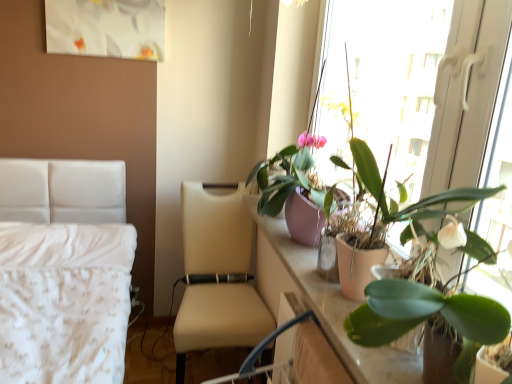
Question: Is the position of green matte plant at right, acting as the 3th houseplant starting from the bottom, less distant than that of green matte plant at upper right, placed as the first houseplant when sorted from bottom to top?

Choices:
 (A) yes
 (B) no

Answer: (A)

Question: Considering the relative positions of green matte plant at right, acting as the 3th houseplant starting from the bottom, and green matte plant at upper right, which is the third houseplant from top to bottom, in the image provided, is green matte plant at right, acting as the 3th houseplant starting from the bottom, to the left of green matte plant at upper right, which is the third houseplant from top to bottom, from the viewer's perspective?

Choices:
 (A) no
 (B) yes

Answer: (A)

Question: From the image's perspective, is green matte plant at right, acting as the 3th houseplant starting from the bottom, below green matte plant at upper right, placed as the first houseplant when sorted from bottom to top?

Choices:
 (A) yes
 (B) no

Answer: (B)

Question: Does green matte plant at right, which ranks as the first houseplant in top-to-bottom order, appear on the right side of green matte plant at upper right, which is the third houseplant from top to bottom?

Choices:
 (A) yes
 (B) no

Answer: (A)

Question: From the image's perspective, is green matte plant at right, acting as the 3th houseplant starting from the bottom, on top of green matte plant at upper right, placed as the first houseplant when sorted from bottom to top?

Choices:
 (A) no
 (B) yes

Answer: (B)

Question: Is green matte plant at right, which ranks as the first houseplant in top-to-bottom order, positioned far away from green matte plant at upper right, which is the third houseplant from top to bottom?

Choices:
 (A) no
 (B) yes

Answer: (A)

Question: Is beige leather chair at center thinner than green matte plant at upper right, placed as the first houseplant when sorted from bottom to top?

Choices:
 (A) no
 (B) yes

Answer: (A)

Question: Does beige leather chair at center have a lesser height compared to green matte plant at upper right, placed as the first houseplant when sorted from bottom to top?

Choices:
 (A) yes
 (B) no

Answer: (B)

Question: From the image's perspective, does beige leather chair at center appear lower than green matte plant at upper right, placed as the first houseplant when sorted from bottom to top?

Choices:
 (A) yes
 (B) no

Answer: (A)

Question: Is beige leather chair at center far from green matte plant at upper right, which is the third houseplant from top to bottom?

Choices:
 (A) no
 (B) yes

Answer: (B)

Question: Is beige leather chair at center behind green matte plant at upper right, which is the third houseplant from top to bottom?

Choices:
 (A) no
 (B) yes

Answer: (B)

Question: Are beige leather chair at center and green matte plant at upper right, which is the third houseplant from top to bottom, beside each other?

Choices:
 (A) yes
 (B) no

Answer: (B)

Question: Considering the relative sizes of pink matte plant pot at right and green matte plant at upper right, placed as the first houseplant when sorted from bottom to top, in the image provided, is pink matte plant pot at right thinner than green matte plant at upper right, placed as the first houseplant when sorted from bottom to top,?

Choices:
 (A) no
 (B) yes

Answer: (B)